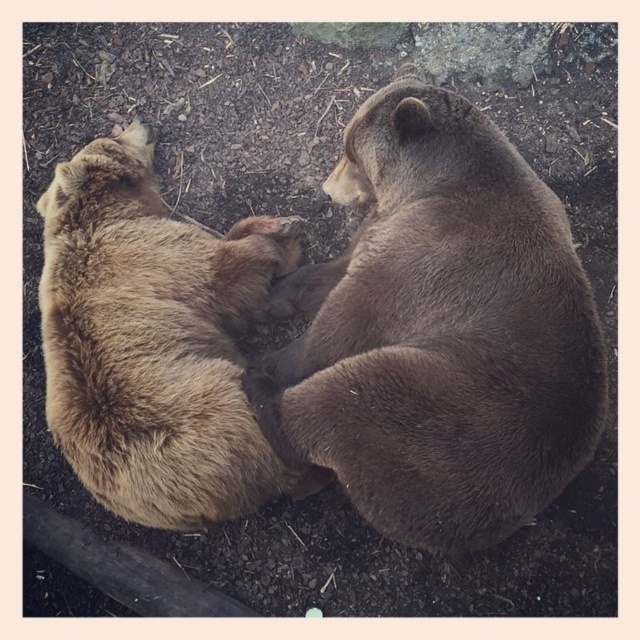
Between brown furry bear at center and fuzzy brown bear at center, which one is positioned lower?

Positioned lower is brown furry bear at center.

Which of these two, brown furry bear at center or fuzzy brown bear at center, stands taller?

Standing taller between the two is brown furry bear at center.

Where is `brown furry bear at center`? brown furry bear at center is located at coordinates (440, 332).